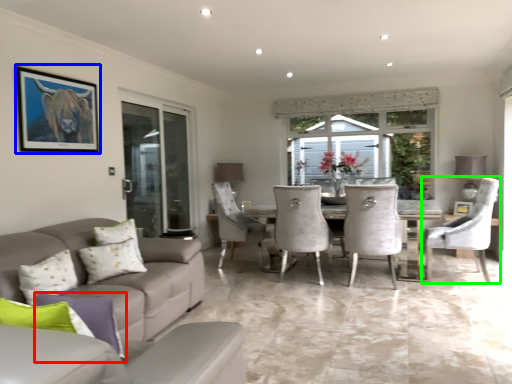
Question: Which is nearer to the pillow (highlighted by a red box)? picture frame (highlighted by a blue box) or chair (highlighted by a green box).

Choices:
 (A) picture frame
 (B) chair

Answer: (A)